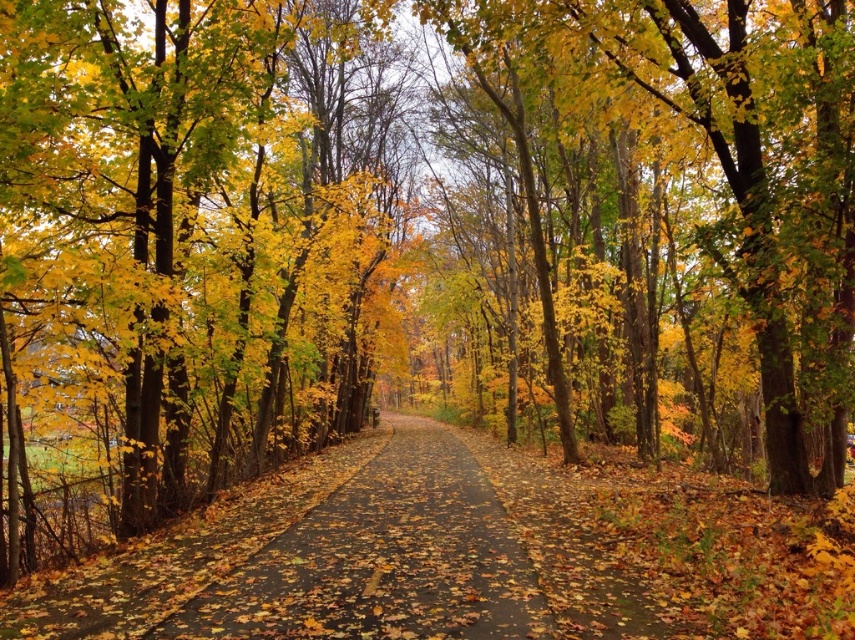
This screenshot has height=640, width=855. Describe the element at coordinates (724, 172) in the screenshot. I see `yellow-green leaves at center` at that location.

Is yellow-green leaves at center shorter than brown asphalt path at center?

No, yellow-green leaves at center is not shorter than brown asphalt path at center.

Does point (826, 3) lie in front of point (357, 500)?

No.

Identify the location of yellow-green leaves at center. Image resolution: width=855 pixels, height=640 pixels. (724, 172).